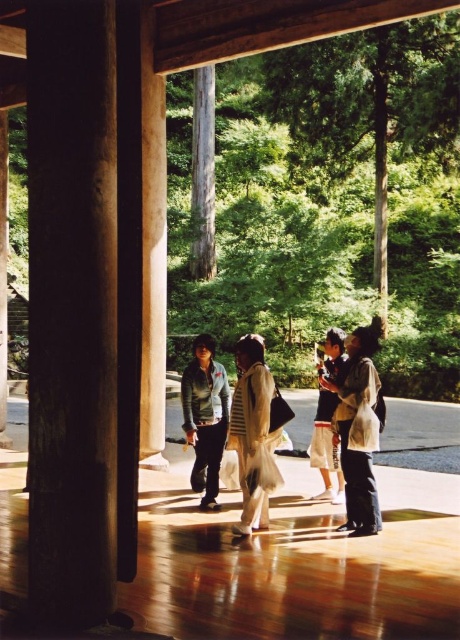
Question: Is matte gray jacket at center behind denim shorts at center?

Choices:
 (A) no
 (B) yes

Answer: (A)

Question: Does matte gray jacket at center have a greater width compared to smooth brown wood at center?

Choices:
 (A) yes
 (B) no

Answer: (B)

Question: Which object is farther from the camera taking this photo?

Choices:
 (A) smooth brown wood at center
 (B) smooth brown wood pillar at left

Answer: (A)

Question: Can you confirm if smooth brown wood pillar at left is positioned to the right of smooth brown wood pillar at center?

Choices:
 (A) yes
 (B) no

Answer: (A)

Question: Which of the following is the farthest from the observer?

Choices:
 (A) (372, 404)
 (B) (344, 333)
 (C) (97, 538)
 (D) (257, 419)

Answer: (B)

Question: Which of the following is the closest to the observer?

Choices:
 (A) matte gray jacket at center
 (B) smooth brown wood at center

Answer: (A)